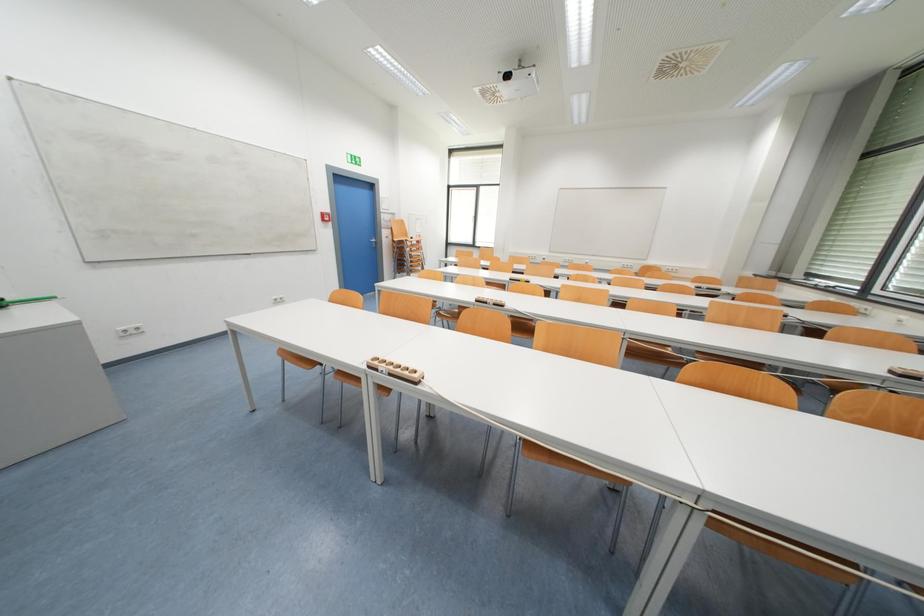
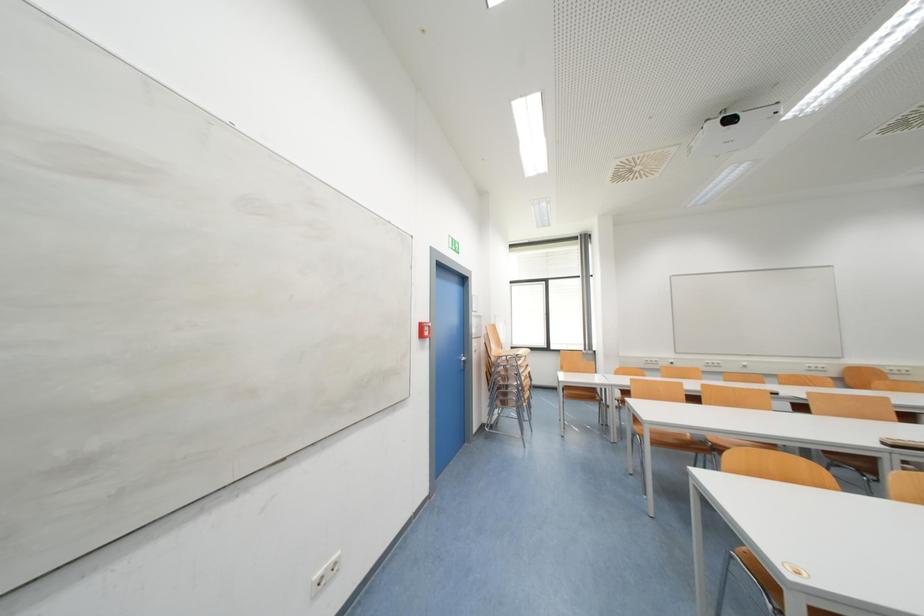
The images are taken continuously from a first-person perspective. In which direction are you moving?

The movement direction of the cameraman is left, forward.